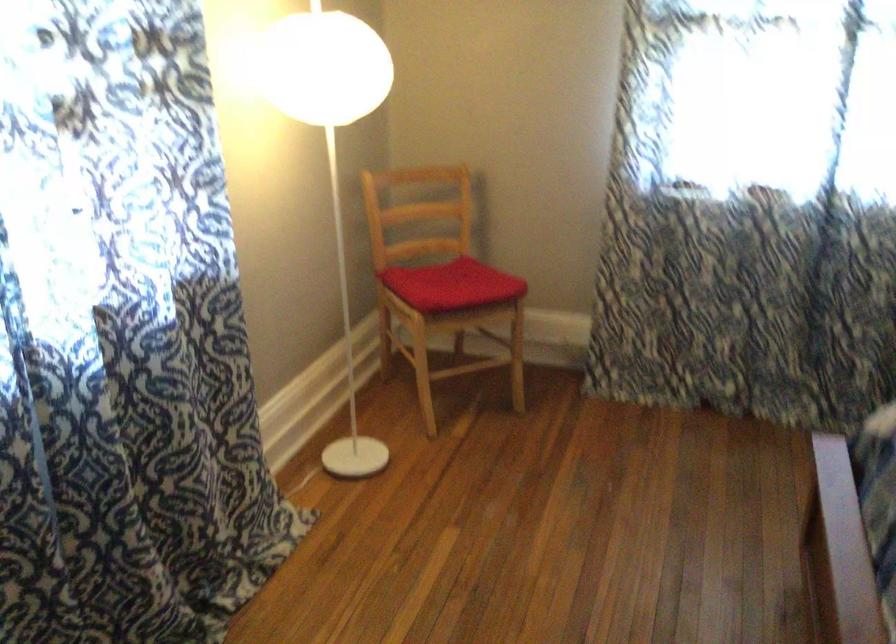
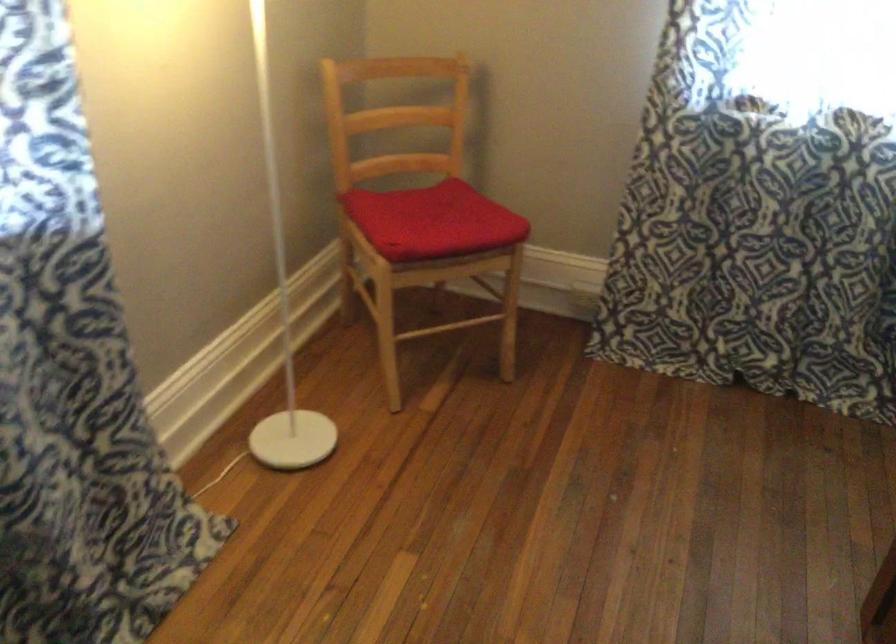
Question: How did the camera likely rotate?

Choices:
 (A) Left
 (B) Right
 (C) Up
 (D) Down

Answer: (D)